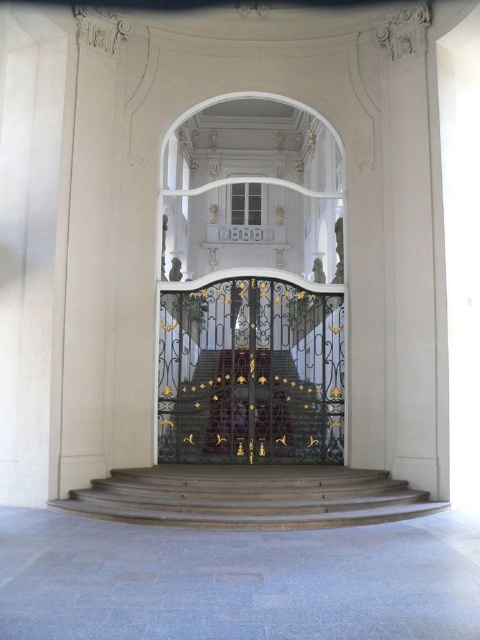
Question: Which object is farther from the camera taking this photo?

Choices:
 (A) wooden stairs at center
 (B) gold wrought iron gate at center
 (C) white marble balustrade at center
 (D) gold ornate staircase at center

Answer: (C)

Question: Which object is the farthest from the gold ornate staircase at center?

Choices:
 (A) gold wrought iron gate at center
 (B) white marble balustrade at center

Answer: (B)

Question: Can you confirm if wooden stairs at center is positioned below gold ornate staircase at center?

Choices:
 (A) no
 (B) yes

Answer: (B)

Question: Estimate the real-world distances between objects in this image. Which object is farther from the wooden stairs at center?

Choices:
 (A) gold wrought iron gate at center
 (B) gold ornate staircase at center

Answer: (A)

Question: Does wooden stairs at center appear on the left side of white marble balustrade at center?

Choices:
 (A) yes
 (B) no

Answer: (B)

Question: Is gold wrought iron gate at center to the left of wooden stairs at center from the viewer's perspective?

Choices:
 (A) yes
 (B) no

Answer: (A)